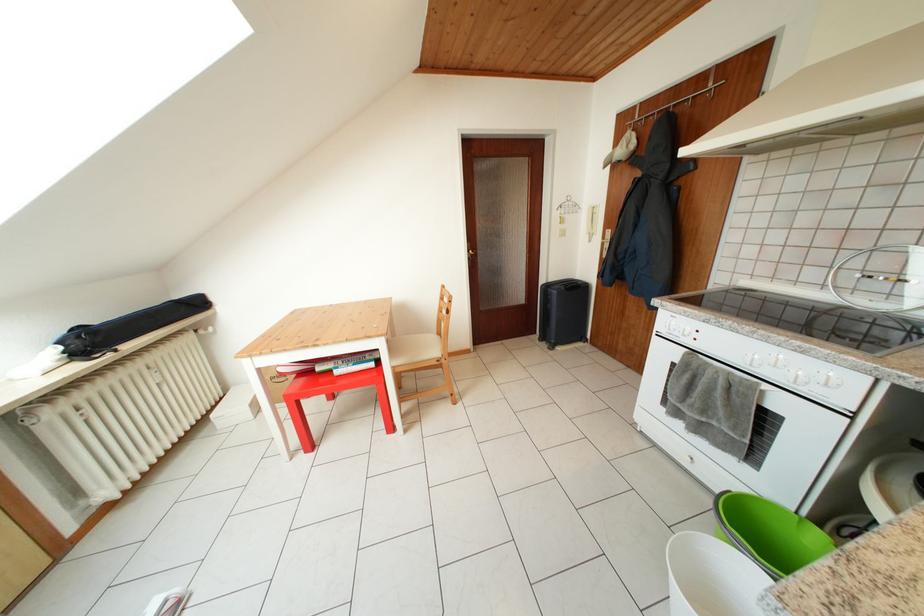
The location [128,326] corresponds to which object?

It refers to a long black bag.